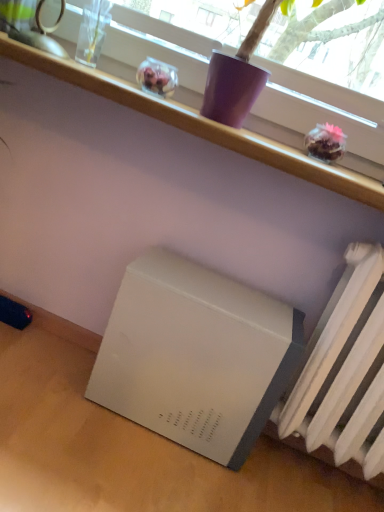
Question: Relative to white matte refrigerator at lower left, is white matte radiator at lower right in front or behind?

Choices:
 (A) behind
 (B) front

Answer: (B)

Question: From a real-world perspective, is white matte radiator at lower right above or below white matte refrigerator at lower left?

Choices:
 (A) above
 (B) below

Answer: (A)

Question: Which object is the farthest from the white plastic shelf at upper center?

Choices:
 (A) white matte table at lower right
 (B) white matte refrigerator at lower left
 (C) white matte radiator at lower right

Answer: (A)

Question: Which object is positioned closest to the white plastic shelf at upper center?

Choices:
 (A) white matte radiator at lower right
 (B) white matte table at lower right
 (C) white matte refrigerator at lower left

Answer: (A)